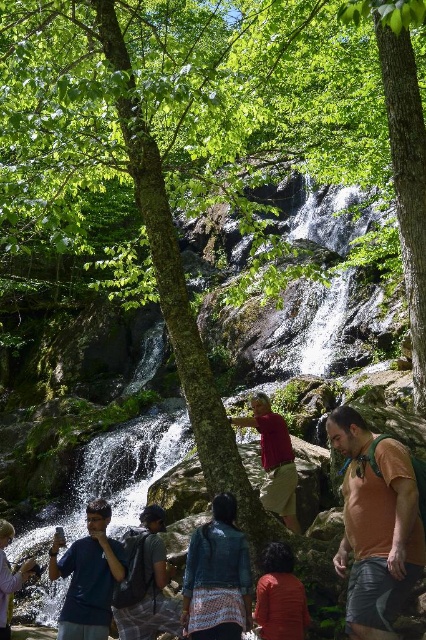
Question: Which point is closer to the camera?

Choices:
 (A) plaid shirt backpack at center
 (B) matte red shirt at center
 (C) matte orange shirt at lower center

Answer: (C)

Question: Can you confirm if matte orange shirt at lower center is thinner than matte black phone at lower left?

Choices:
 (A) yes
 (B) no

Answer: (A)

Question: Does orange t-shirt at center appear over blue textured jacket at center?

Choices:
 (A) yes
 (B) no

Answer: (A)

Question: Based on their relative distances, which object is nearer to the matte black phone at lower left?

Choices:
 (A) orange t-shirt at center
 (B) matte orange shirt at lower center
 (C) dark blue t-shirt at lower left

Answer: (C)

Question: Is blue textured jacket at center bigger than dark blue t-shirt at lower left?

Choices:
 (A) no
 (B) yes

Answer: (A)

Question: Which is farther from the dark blue t-shirt at lower left?

Choices:
 (A) matte black phone at lower left
 (B) matte red shirt at center

Answer: (B)